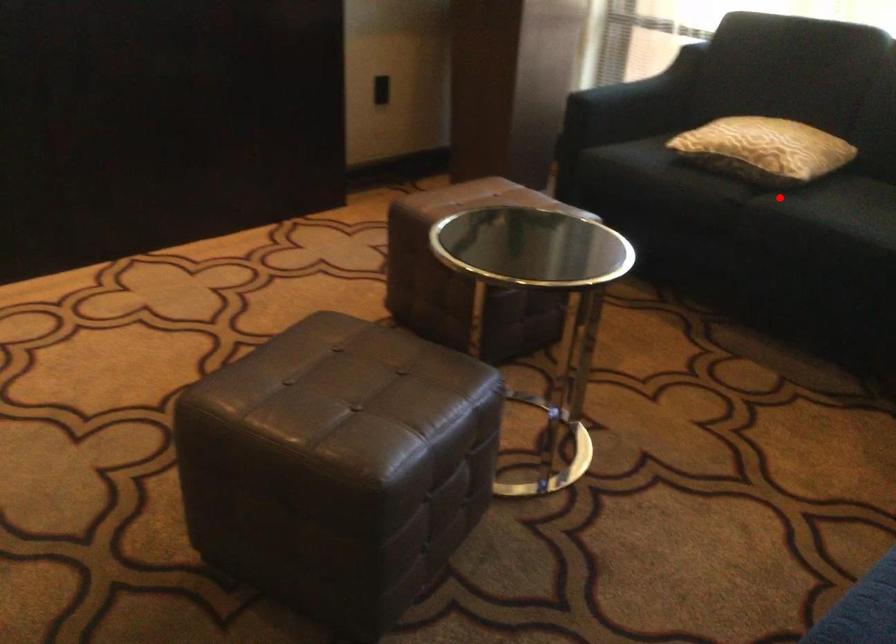
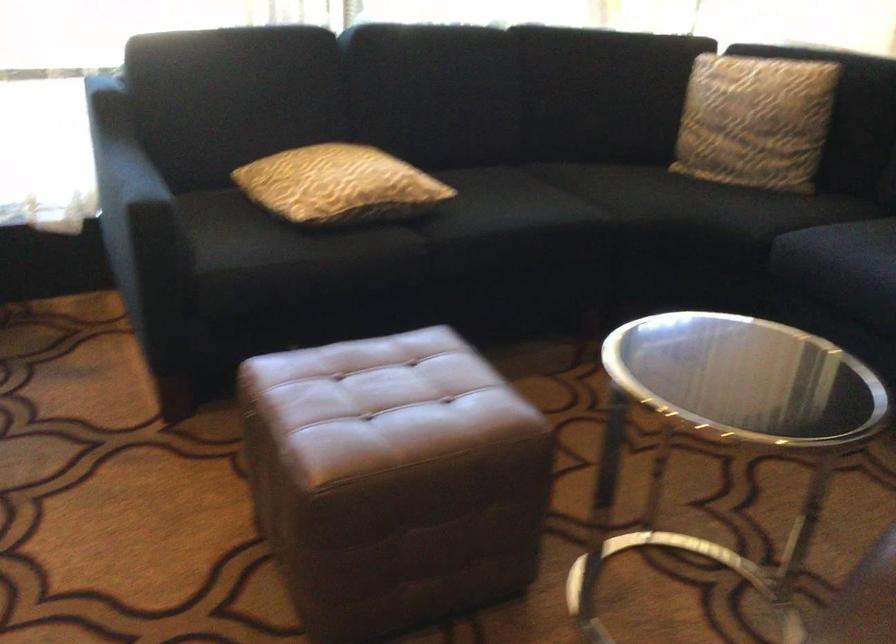
Find the pixel in the second image that matches the highlighted location in the first image.

(426, 227)